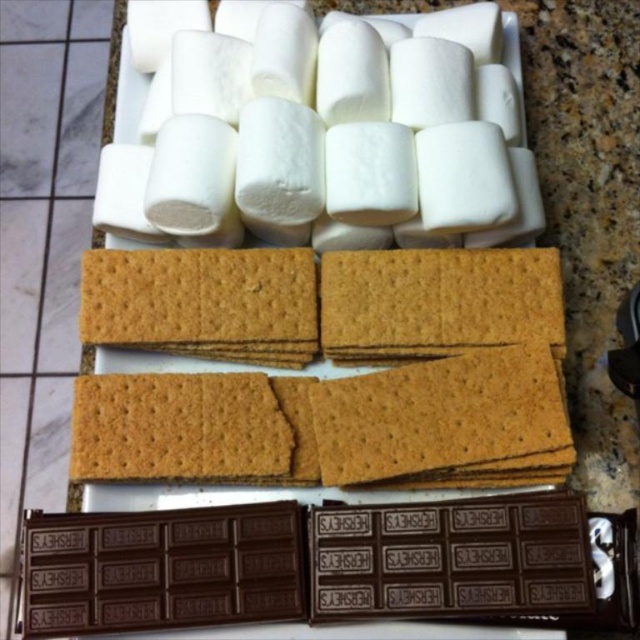
Which is in front, point (376, 166) or point (115, 515)?

Point (115, 515) is in front.

Does white fluffy marshmallows at upper center have a larger size compared to dark chocolate bar at bottom?

Yes, white fluffy marshmallows at upper center is bigger than dark chocolate bar at bottom.

Is point (404, 220) farther from camera compared to point (449, 502)?

Yes, point (404, 220) is behind point (449, 502).

In order to click on white fluffy marshmallows at upper center in this screenshot , I will do `click(330, 134)`.